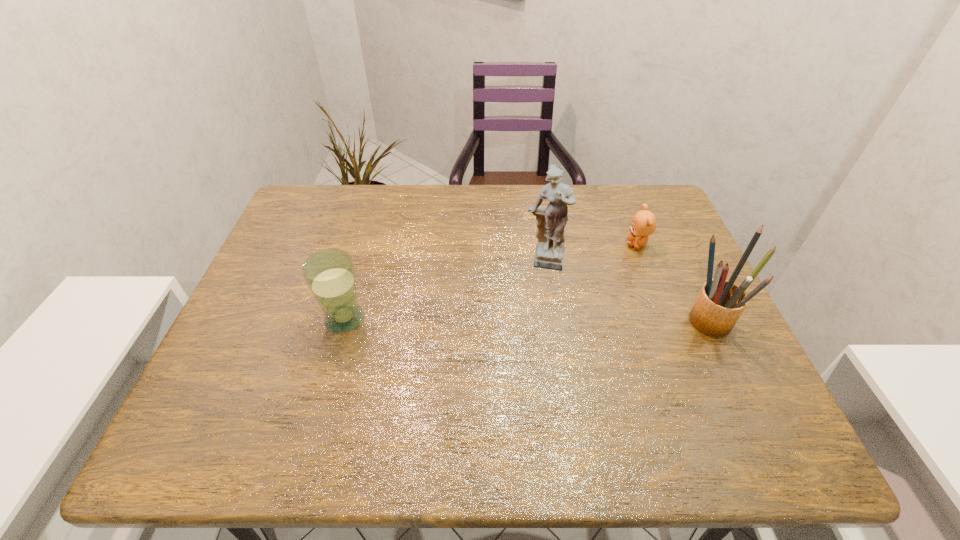
Where is `free space on the desktop that is between the leftmost object and the pencil box and is positioned on the face of the teddy bear`? free space on the desktop that is between the leftmost object and the pencil box and is positioned on the face of the teddy bear is located at coordinates (558, 320).

Locate an element on the screen. free spot on the desktop that is between the glass and the pencil box and is positioned on the front-facing side of the tallest object is located at coordinates click(x=544, y=320).